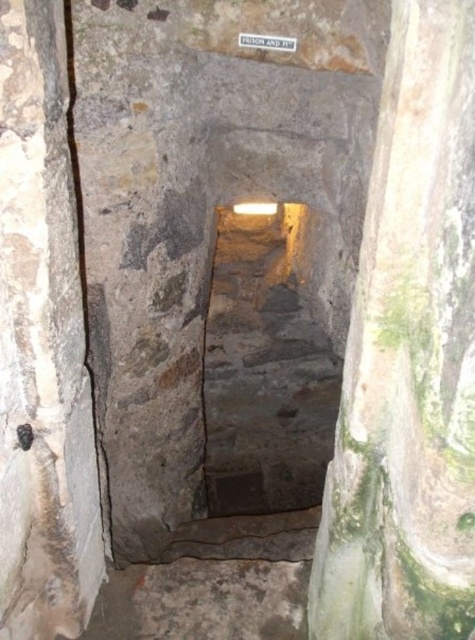
You are standing at the entrance of the narrow stone passageway and see two points marked in the image. The first point is at coordinates point (455,26), and the second is at point (28,108). Which point is closer to you?

Point (455,26) is closer to the viewer than point (28,108).

You are navigating through a narrow stone passageway and encounter two pillars. The first is a green mossy stone pillar at center, and the second is a gray stone pillar at left. Which pillar is closer to you as you move forward?

The green mossy stone pillar at center is closer to you because it is positioned in front of the gray stone pillar at left.

You are an archaeologist carrying a 24 inch long measuring rod. You need to measure the gap between the green mossy stone pillar at center and the gray stone pillar at left. Can your rod fit entirely within the gap without bending?

The distance between the green mossy stone pillar at center and the gray stone pillar at left is 24.17 inches. Since your rod is 24 inches long, it can fit entirely within the gap without bending.